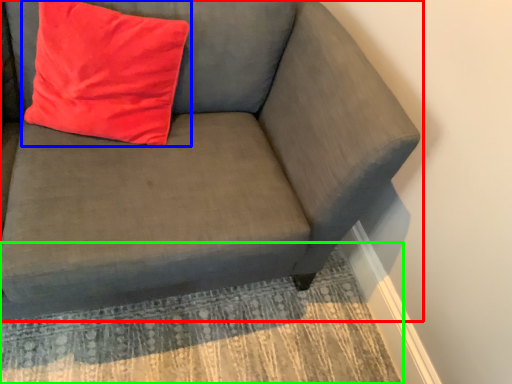
Question: Which object is positioned farthest from studio couch (highlighted by a red box)? Select from pillow (highlighted by a blue box) and mat (highlighted by a green box).

Choices:
 (A) pillow
 (B) mat

Answer: (B)